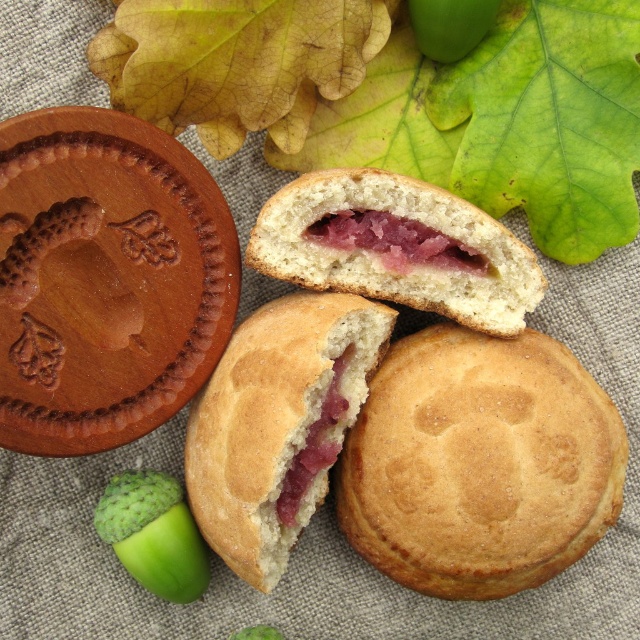
What are the coordinates of the golden crumbly biscuit at center?

The golden crumbly biscuit at center is located at coordinates point (x=278, y=422).